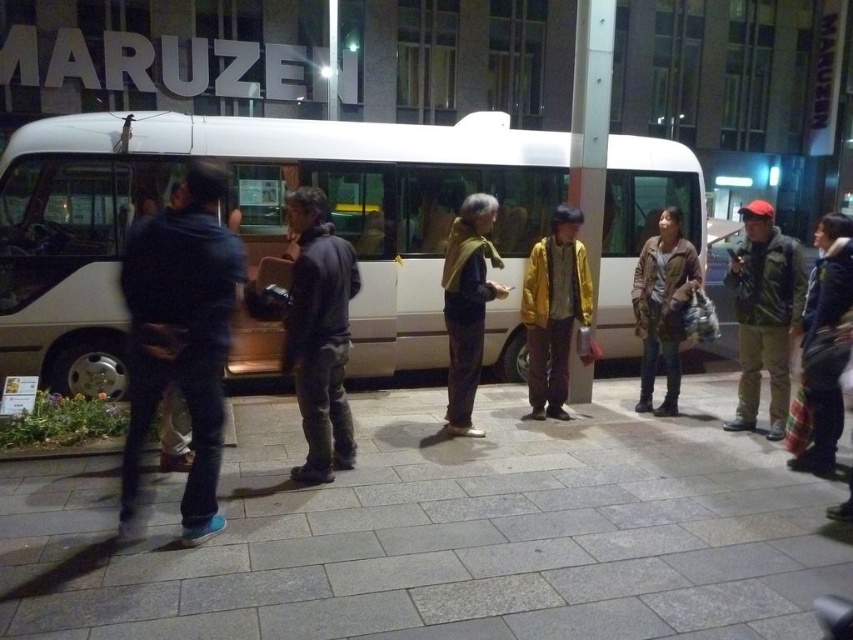
You are standing at the bus stop and want to place a small bench for people to sit. Where should you place it so that it is on the gray concrete pavement at center?

You should place the bench at point (444, 532) on the gray concrete pavement at center as that is the exact location of the pavement.

You are a pedestrian standing on the gray concrete pavement at center. You want to board the white matte bus at center. Which direction should you walk to get closer to the bus?

Since the gray concrete pavement at center is closer to the viewer than the white matte bus at center, you should walk forward towards the bus to get closer to it.

What is located at the coordinate point (x=180, y=339) in the image?

The dark blue fabric jacket at left is located at the coordinate point (x=180, y=339).